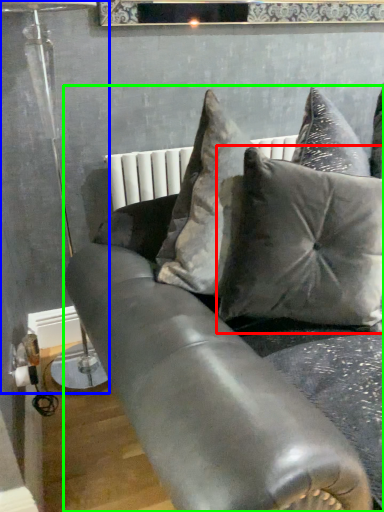
Question: Estimate the real-world distances between objects in this image. Which object is closer to pillow (highlighted by a red box), lamp (highlighted by a blue box) or studio couch (highlighted by a green box)?

Choices:
 (A) lamp
 (B) studio couch

Answer: (B)